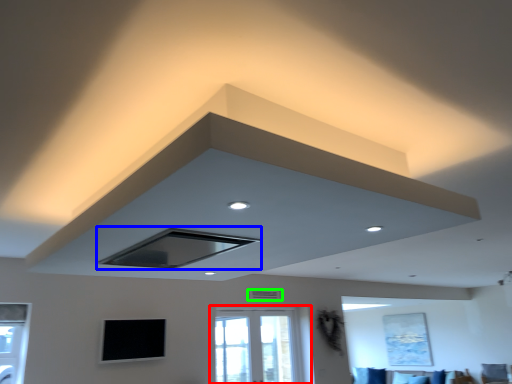
Question: Which is farther away from window (highlighted by a red box)? exhaust hood (highlighted by a blue box) or air conditioning (highlighted by a green box)?

Choices:
 (A) exhaust hood
 (B) air conditioning

Answer: (A)